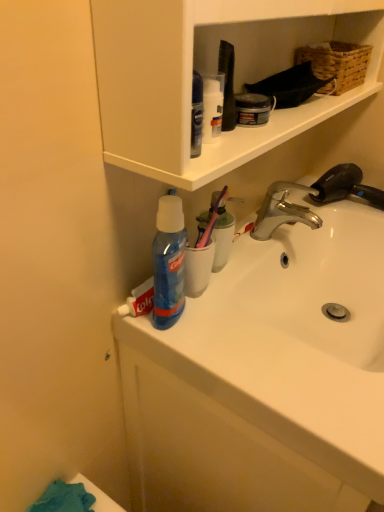
Describe the element at coordinates (265, 378) in the screenshot. This screenshot has width=384, height=512. I see `white glossy sink at center, arranged as the first sink when ordered from the bottom` at that location.

Describe the element at coordinates (345, 186) in the screenshot. I see `silver metallic faucet at upper right` at that location.

Find the location of `silver metallic faucet at upper right`. silver metallic faucet at upper right is located at coordinates (345, 186).

At what (x,y) coordinates should I click in order to perform the action: click on white glossy sink at center, arranged as the first sink when ordered from the bottom. Please return your answer as a coordinate pair (x, y). The height and width of the screenshot is (512, 384). Looking at the image, I should click on (265, 378).

Considering the relative positions of white glossy sink at center, arranged as the first sink when ordered from the bottom, and chrome metallic faucet at upper right in the image provided, is white glossy sink at center, arranged as the first sink when ordered from the bottom, to the left of chrome metallic faucet at upper right from the viewer's perspective?

No, white glossy sink at center, arranged as the first sink when ordered from the bottom, is not to the left of chrome metallic faucet at upper right.

Considering the relative sizes of white glossy sink at center, arranged as the 2th sink when viewed from the top, and chrome metallic faucet at upper right in the image provided, is white glossy sink at center, arranged as the 2th sink when viewed from the top, thinner than chrome metallic faucet at upper right?

In fact, white glossy sink at center, arranged as the 2th sink when viewed from the top, might be wider than chrome metallic faucet at upper right.

Considering their positions, is white glossy sink at center, arranged as the 2th sink when viewed from the top, located in front of or behind chrome metallic faucet at upper right?

Clearly, white glossy sink at center, arranged as the 2th sink when viewed from the top, is in front of chrome metallic faucet at upper right.

From the image's perspective, is white glossy sink at center, arranged as the 2th sink when viewed from the top, on top of chrome metallic faucet at upper right?

No, from the image's perspective, white glossy sink at center, arranged as the 2th sink when viewed from the top, is not above chrome metallic faucet at upper right.

Can you confirm if woven brown basket at upper right is thinner than silver metallic faucet at upper right?

Indeed, woven brown basket at upper right has a lesser width compared to silver metallic faucet at upper right.

From the picture: How many degrees apart are the facing directions of woven brown basket at upper right and silver metallic faucet at upper right?

The angle between the facing direction of woven brown basket at upper right and the facing direction of silver metallic faucet at upper right is 11.8 degrees.

Can you confirm if woven brown basket at upper right is smaller than silver metallic faucet at upper right?

Yes, woven brown basket at upper right is smaller than silver metallic faucet at upper right.

Are woven brown basket at upper right and silver metallic faucet at upper right far apart?

No, woven brown basket at upper right is not far from silver metallic faucet at upper right.

Is the position of chrome metallic faucet at upper right less distant than that of white glossy sink at center, arranged as the 2th sink when viewed from the top?

No, the depth of chrome metallic faucet at upper right is greater than that of white glossy sink at center, arranged as the 2th sink when viewed from the top.

Identify the location of tap above the white glossy sink at center, arranged as the first sink when ordered from the bottom (from the image's perspective). (283, 210).

Is chrome metallic faucet at upper right located outside white glossy sink at center, arranged as the first sink when ordered from the bottom?

chrome metallic faucet at upper right is positioned outside white glossy sink at center, arranged as the first sink when ordered from the bottom.

Which is nearer, (283, 223) or (261, 388)?

The point (261, 388) is closer to the camera.

Is white glossy sink at center, placed as the 1th sink when sorted from top to bottom, at the right side of chrome metallic faucet at upper right?

Yes.

Consider the image. Who is taller, white glossy sink at center, the 2th sink from the bottom, or chrome metallic faucet at upper right?

Standing taller between the two is chrome metallic faucet at upper right.

Which is in front, white glossy sink at center, the 2th sink from the bottom, or chrome metallic faucet at upper right?

Positioned in front is white glossy sink at center, the 2th sink from the bottom.

Is white glossy sink at center, the 2th sink from the bottom, located outside chrome metallic faucet at upper right?

Yes, white glossy sink at center, the 2th sink from the bottom, is not within chrome metallic faucet at upper right.

Is chrome metallic faucet at upper right positioned with its back to white glossy sink at center, placed as the 1th sink when sorted from top to bottom?

chrome metallic faucet at upper right is not turned away from white glossy sink at center, placed as the 1th sink when sorted from top to bottom.

Is the depth of chrome metallic faucet at upper right less than that of white glossy sink at center, placed as the 1th sink when sorted from top to bottom?

No, it is behind white glossy sink at center, placed as the 1th sink when sorted from top to bottom.

Who is taller, chrome metallic faucet at upper right or white glossy sink at center, the 2th sink from the bottom?

Standing taller between the two is chrome metallic faucet at upper right.

Which of these two, chrome metallic faucet at upper right or white glossy sink at center, placed as the 1th sink when sorted from top to bottom, is smaller?

chrome metallic faucet at upper right.

Is white glossy sink at center, the 2th sink from the bottom, turned away from woven brown basket at upper right?

white glossy sink at center, the 2th sink from the bottom, is not turned away from woven brown basket at upper right.

From a real-world perspective, is white glossy sink at center, placed as the 1th sink when sorted from top to bottom, on top of woven brown basket at upper right?

No.

Can you confirm if white glossy sink at center, placed as the 1th sink when sorted from top to bottom, is taller than woven brown basket at upper right?

Correct, white glossy sink at center, placed as the 1th sink when sorted from top to bottom, is much taller as woven brown basket at upper right.

How distant is woven brown basket at upper right from white glossy sink at center, arranged as the 2th sink when viewed from the top?

woven brown basket at upper right is 57.38 centimeters from white glossy sink at center, arranged as the 2th sink when viewed from the top.

Which of these two, woven brown basket at upper right or white glossy sink at center, arranged as the first sink when ordered from the bottom, is thinner?

woven brown basket at upper right is thinner.

Does point (343, 78) appear closer or farther from the camera than point (304, 242)?

Point (343, 78).

Is woven brown basket at upper right looking in the opposite direction of white glossy sink at center, arranged as the first sink when ordered from the bottom?

woven brown basket at upper right is not turned away from white glossy sink at center, arranged as the first sink when ordered from the bottom.

From the chrome metallic faucet at upper right, count 1st sink to the right and point to it. Please provide its 2D coordinates.

[(265, 378)]

The height and width of the screenshot is (512, 384). I want to click on faucet lying behind the woven brown basket at upper right, so click(345, 186).

Looking at this image, based on their spatial positions, is white glossy sink at center, arranged as the 2th sink when viewed from the top, or silver metallic faucet at upper right closer to woven brown basket at upper right?

Based on the image, silver metallic faucet at upper right appears to be nearer to woven brown basket at upper right.

From the image, which object appears to be farther from white glossy sink at center, the 2th sink from the bottom, woven brown basket at upper right or chrome metallic faucet at upper right?

The object further to white glossy sink at center, the 2th sink from the bottom, is woven brown basket at upper right.

In the scene shown: From the image, which object appears to be farther from silver metallic faucet at upper right, white glossy sink at center, the 2th sink from the bottom, or chrome metallic faucet at upper right?

white glossy sink at center, the 2th sink from the bottom, is positioned further to the anchor silver metallic faucet at upper right.

Considering their positions, is chrome metallic faucet at upper right positioned further to white glossy sink at center, arranged as the first sink when ordered from the bottom, than woven brown basket at upper right?

The object further to white glossy sink at center, arranged as the first sink when ordered from the bottom, is woven brown basket at upper right.

Which object lies nearer to the anchor point chrome metallic faucet at upper right, white glossy sink at center, placed as the 1th sink when sorted from top to bottom, or silver metallic faucet at upper right?

Among the two, silver metallic faucet at upper right is located nearer to chrome metallic faucet at upper right.

Which object lies nearer to the anchor point silver metallic faucet at upper right, woven brown basket at upper right or white glossy sink at center, arranged as the first sink when ordered from the bottom?

The object closer to silver metallic faucet at upper right is woven brown basket at upper right.

Which object lies nearer to the anchor point chrome metallic faucet at upper right, white glossy sink at center, placed as the 1th sink when sorted from top to bottom, or woven brown basket at upper right?

The object closer to chrome metallic faucet at upper right is white glossy sink at center, placed as the 1th sink when sorted from top to bottom.

From the image, which object appears to be nearer to white glossy sink at center, arranged as the first sink when ordered from the bottom, silver metallic faucet at upper right or white glossy sink at center, the 2th sink from the bottom?

Based on the image, white glossy sink at center, the 2th sink from the bottom, appears to be nearer to white glossy sink at center, arranged as the first sink when ordered from the bottom.

Where is `faucet between woven brown basket at upper right and white glossy sink at center, arranged as the first sink when ordered from the bottom, in the up-down direction`? faucet between woven brown basket at upper right and white glossy sink at center, arranged as the first sink when ordered from the bottom, in the up-down direction is located at coordinates (345, 186).

At what (x,y) coordinates should I click in order to perform the action: click on sink between chrome metallic faucet at upper right and white glossy sink at center, arranged as the first sink when ordered from the bottom, in the up-down direction. Please return your answer as a coordinate pair (x, y). This screenshot has height=512, width=384. Looking at the image, I should click on (324, 280).

Locate an element on the screen. sink between silver metallic faucet at upper right and white glossy sink at center, arranged as the 2th sink when viewed from the top, in the up-down direction is located at coordinates (324, 280).

Locate an element on the screen. faucet between woven brown basket at upper right and white glossy sink at center, placed as the 1th sink when sorted from top to bottom, in the vertical direction is located at coordinates (345, 186).